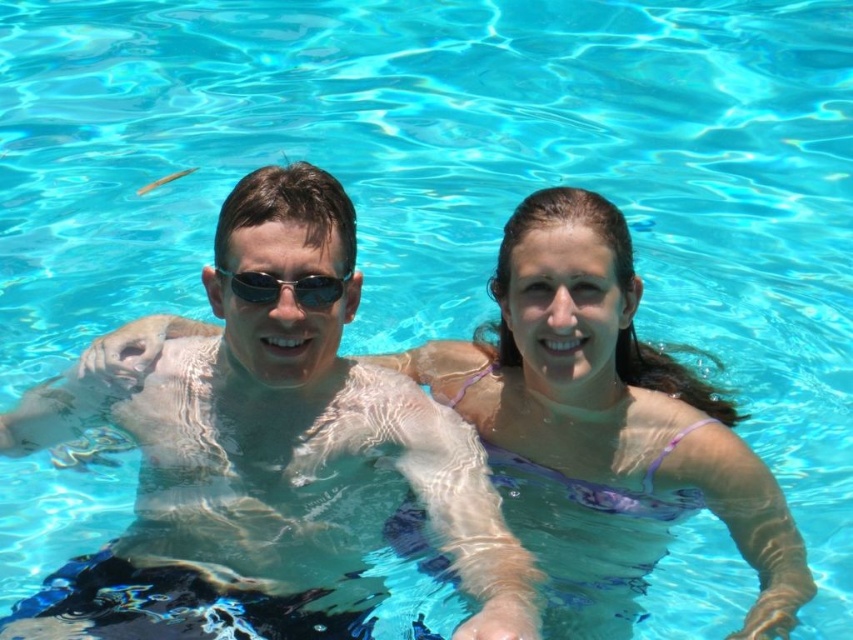
Question: Which point is closer to the camera taking this photo?

Choices:
 (A) (523, 616)
 (B) (264, 275)
 (C) (511, 417)

Answer: (A)

Question: Is glossy skin at center positioned at the back of purple fabric bikini top at upper right?

Choices:
 (A) yes
 (B) no

Answer: (B)

Question: Which of the following is the farthest from the observer?

Choices:
 (A) glossy skin at center
 (B) purple fabric bikini top at upper right

Answer: (B)

Question: Which of the following is the closest to the observer?

Choices:
 (A) glossy skin at center
 (B) sunglasses at center
 (C) purple fabric bikini top at upper right

Answer: (A)

Question: Is purple fabric bikini top at upper right below sunglasses at center?

Choices:
 (A) yes
 (B) no

Answer: (A)

Question: Can you confirm if purple fabric bikini top at upper right is positioned above sunglasses at center?

Choices:
 (A) yes
 (B) no

Answer: (B)